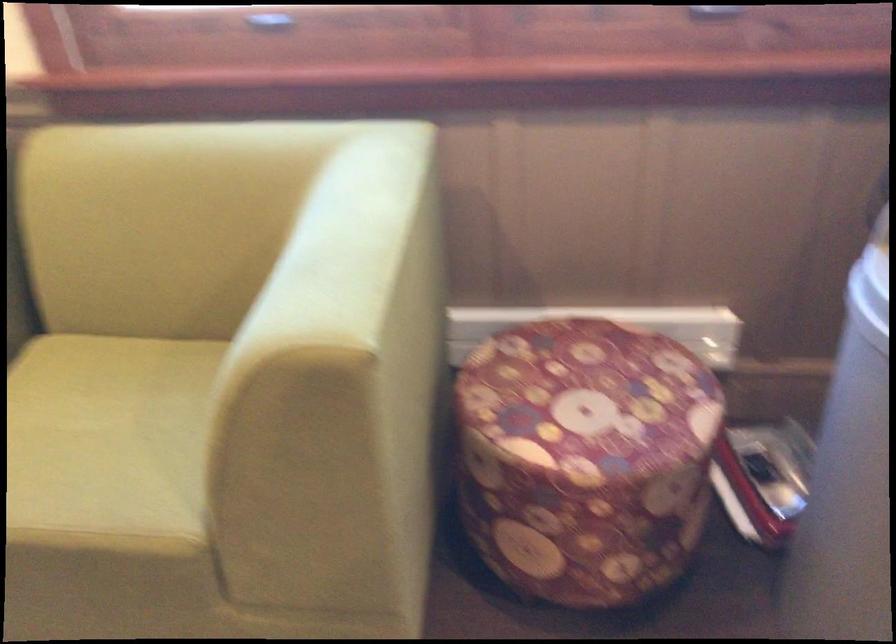
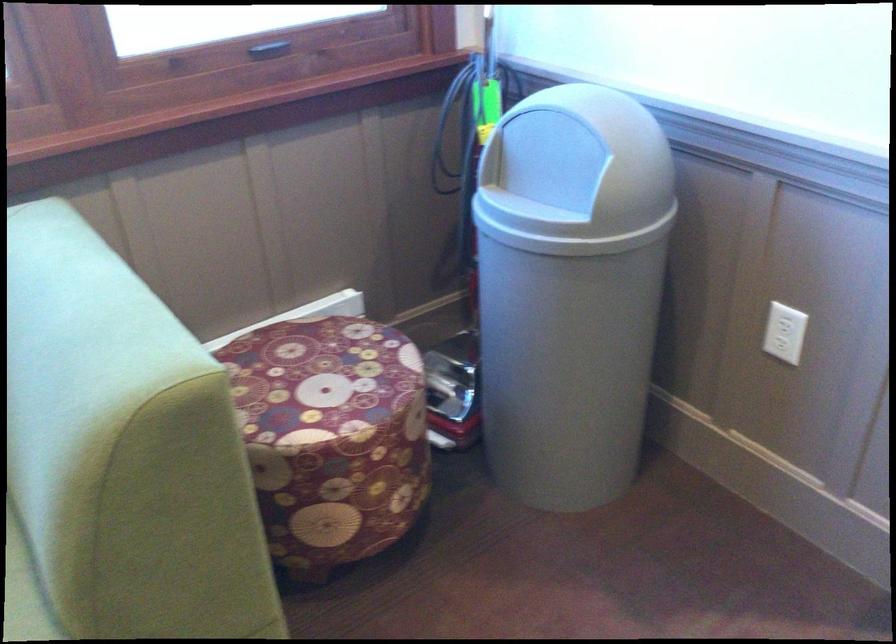
Where in the second image is the point corresponding to (x=597, y=386) from the first image?

(320, 373)